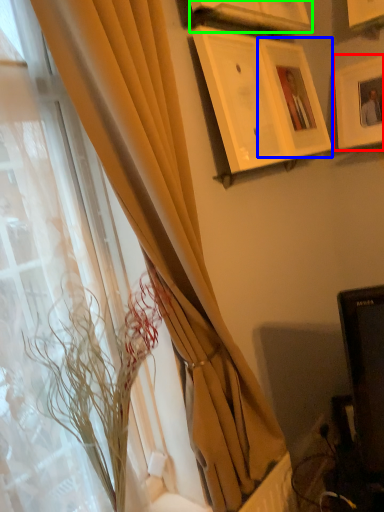
Question: Estimate the real-world distances between objects in this image. Which object is closer to picture frame (highlighted by a red box), picture frame (highlighted by a blue box) or picture frame (highlighted by a green box)?

Choices:
 (A) picture frame
 (B) picture frame

Answer: (A)